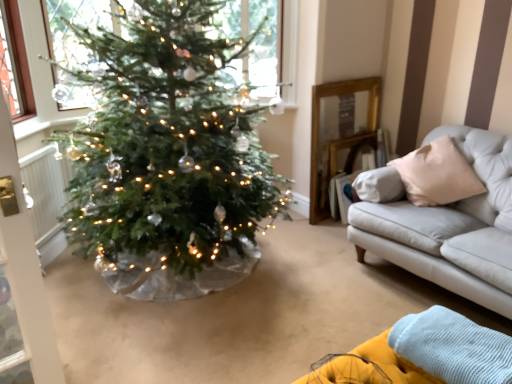
Where is `free area behind yellow fabric couch at lower right`? Image resolution: width=512 pixels, height=384 pixels. free area behind yellow fabric couch at lower right is located at coordinates (312, 330).